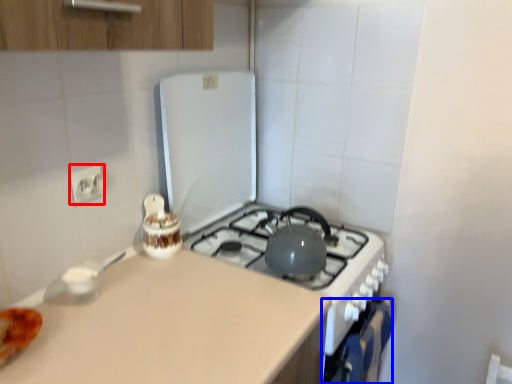
Question: Which point is further to the camera, electric outlet (highlighted by a red box) or oven (highlighted by a blue box)?

Choices:
 (A) electric outlet
 (B) oven

Answer: (B)